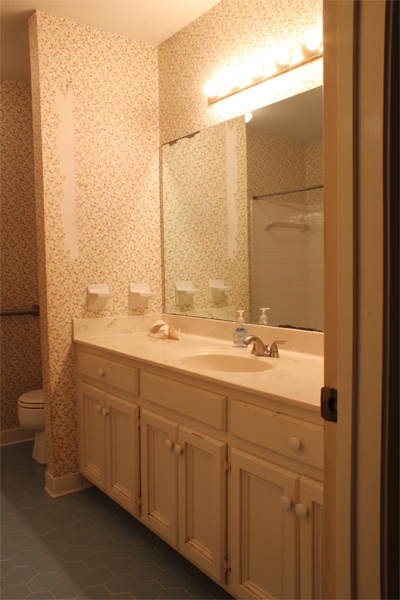
Find the location of a particular element. faucet is located at coordinates (260, 346).